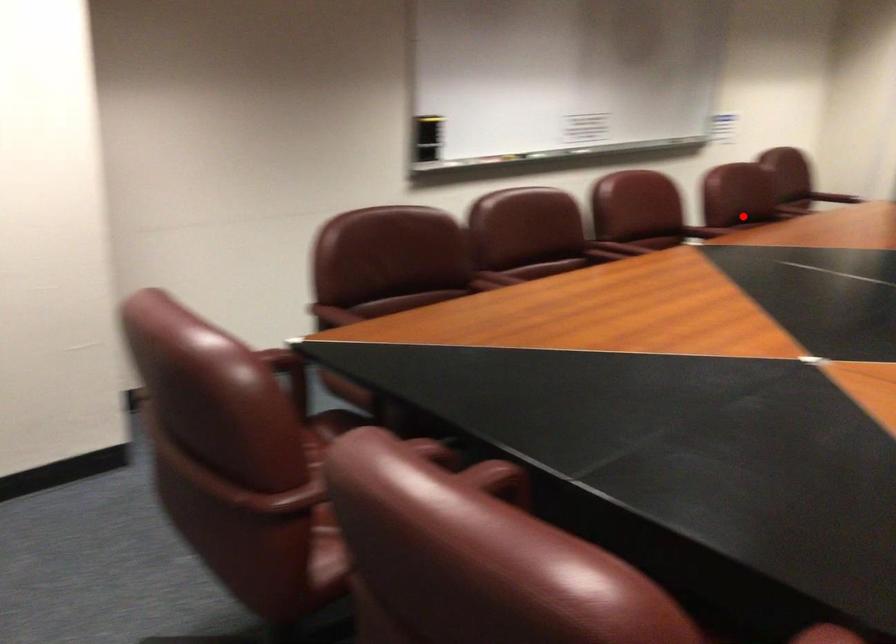
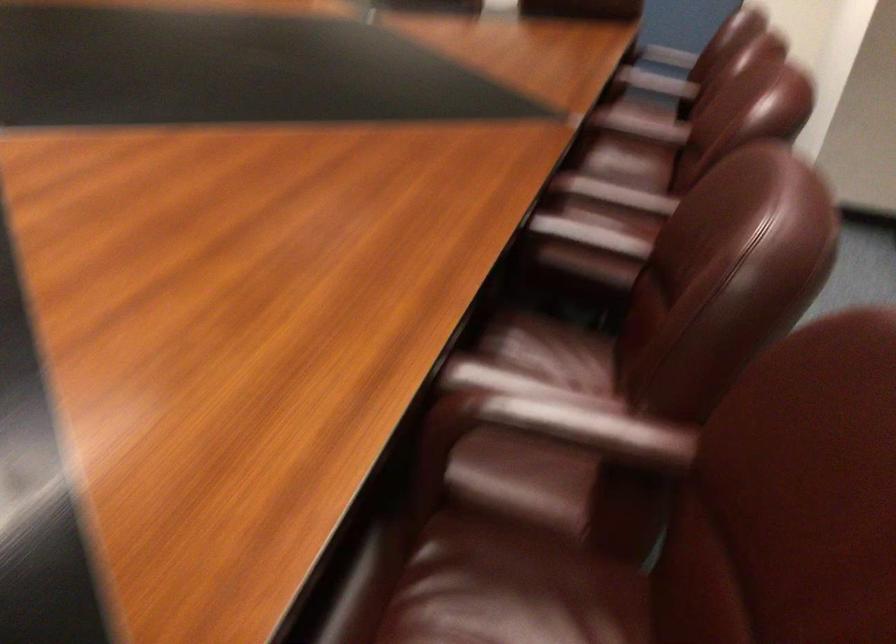
The point at the highlighted location is marked in the first image. Where is the corresponding point in the second image?

(590, 236)